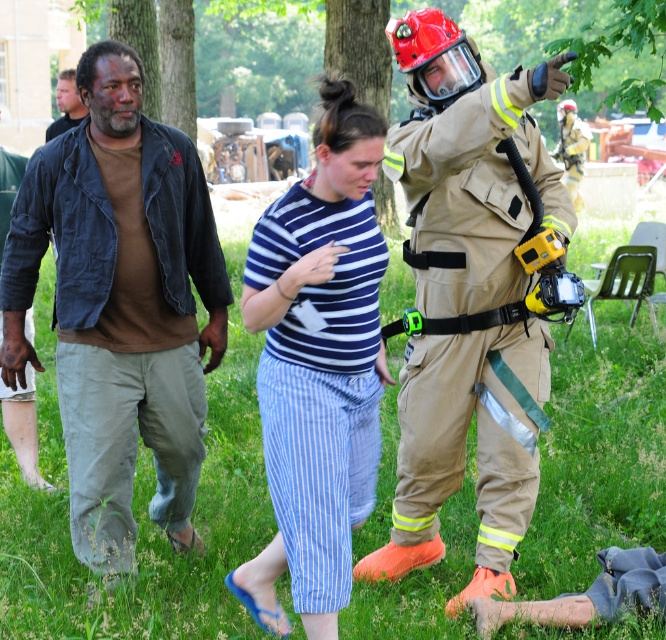
You are a photographer trying to capture a candid shot of the two people in the scene. You want to ensure both the brown cotton shirt at left and the tan fireproof suit at center are visible in the frame. Based on their positions, which direction should you move to position yourself so that both subjects are within your camera view?

Since the brown cotton shirt at left is to the left of the tan fireproof suit at center, you should move to the right side to ensure both subjects are within your camera view.

You are a photographer positioned in the grassy area and want to take a photo of both the brown cotton shirt at left and the brown cotton shirt at upper left. Which shirt should you focus on first to ensure both are in clear view?

You should focus on the brown cotton shirt at left first since it is closer to the viewer, ensuring both shirts are in clear view by adjusting the focus from near to far.